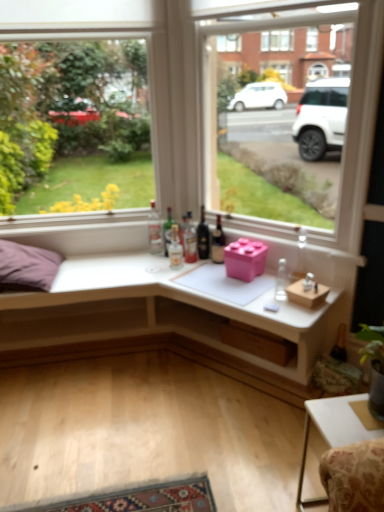
The width and height of the screenshot is (384, 512). Identify the location of vacant area that lies between translucent glass bottle at center, the 5th bottle when ordered from right to left, and clear glass bottle at center, the first bottle positioned from the right. (222, 282).